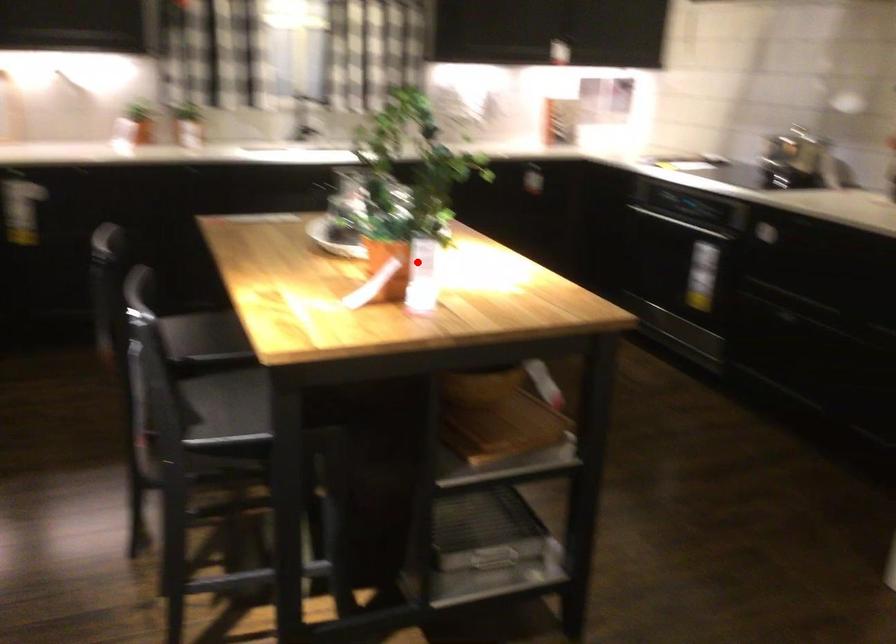
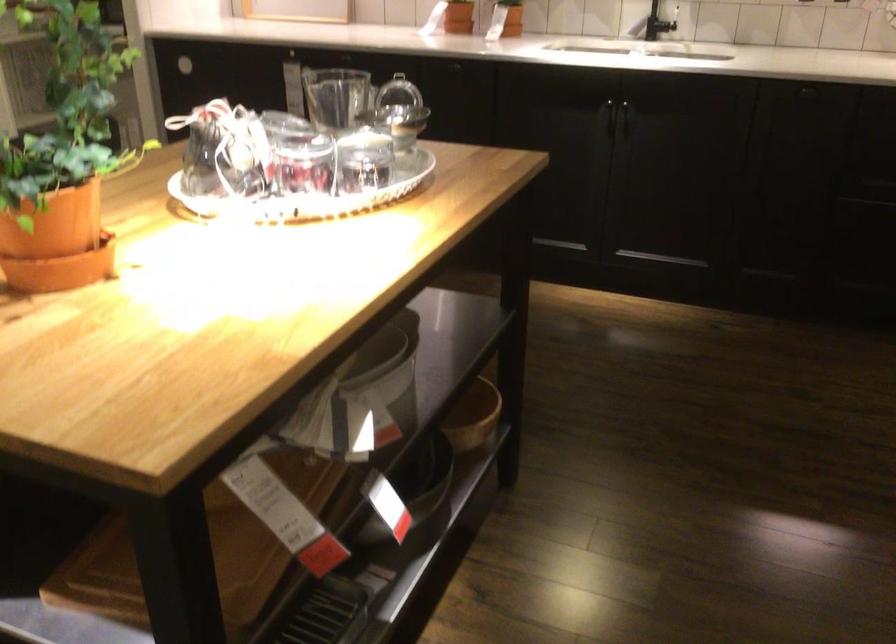
The point at the highlighted location is marked in the first image. Where is the corresponding point in the second image?

(57, 239)